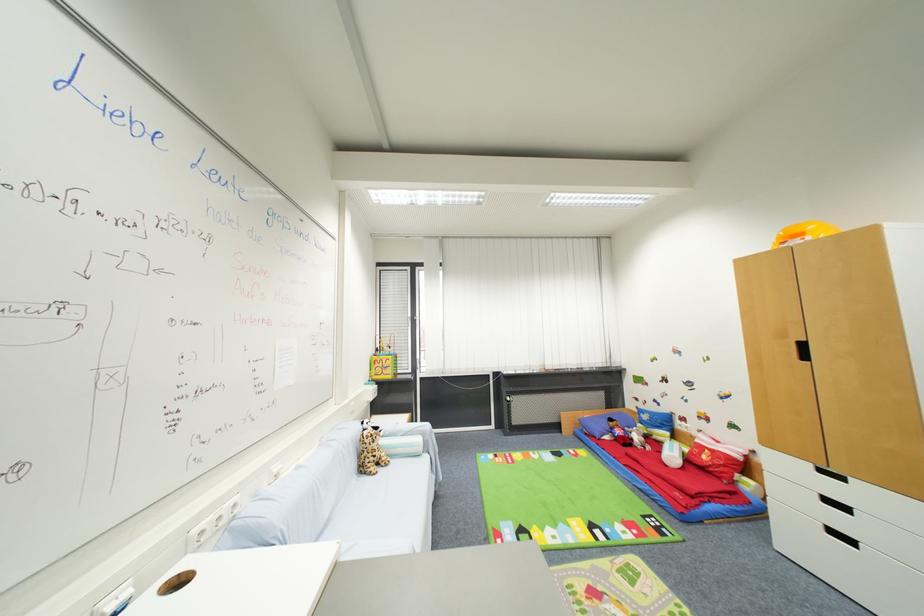
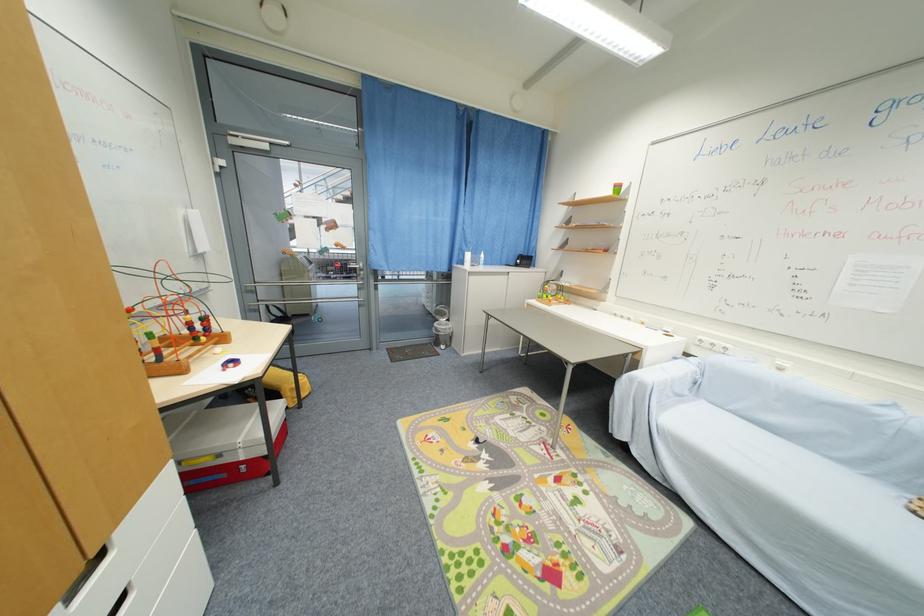
Locate, in the second image, the point that corresponds to the point at 207,535 in the first image.

(706, 342)